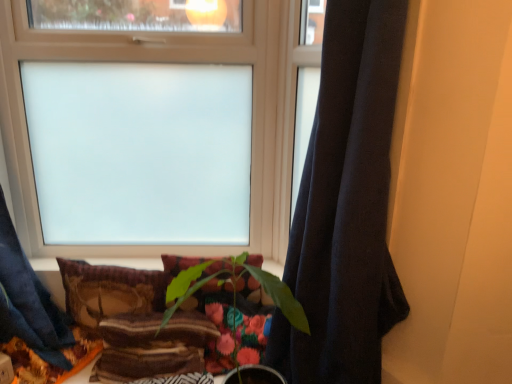
Question: Are green matte plant at center and velvet-like brown pillow at lower center, the 1th pillow viewed from the left, making contact?

Choices:
 (A) yes
 (B) no

Answer: (B)

Question: Is green matte plant at center positioned before velvet-like brown pillow at lower center, acting as the second pillow starting from the right?

Choices:
 (A) no
 (B) yes

Answer: (B)

Question: Does green matte plant at center have a larger size compared to velvet-like brown pillow at lower center, the 1th pillow viewed from the left?

Choices:
 (A) yes
 (B) no

Answer: (A)

Question: Does green matte plant at center have a lesser height compared to velvet-like brown pillow at lower center, the 1th pillow viewed from the left?

Choices:
 (A) no
 (B) yes

Answer: (A)

Question: From the image's perspective, is green matte plant at center located beneath velvet-like brown pillow at lower center, acting as the second pillow starting from the right?

Choices:
 (A) yes
 (B) no

Answer: (A)

Question: Would you say velvet-like brown pillow at lower center, the 1th pillow viewed from the left, is inside or outside green matte plant at center?

Choices:
 (A) inside
 (B) outside

Answer: (B)

Question: Is velvet-like brown pillow at lower center, the 1th pillow viewed from the left, wider or thinner than green matte plant at center?

Choices:
 (A) wide
 (B) thin

Answer: (B)

Question: Considering the relative positions of velvet-like brown pillow at lower center, the 1th pillow viewed from the left, and green matte plant at center in the image provided, is velvet-like brown pillow at lower center, the 1th pillow viewed from the left, to the left or to the right of green matte plant at center?

Choices:
 (A) right
 (B) left

Answer: (B)

Question: From a real-world perspective, is velvet-like brown pillow at lower center, acting as the second pillow starting from the right, positioned above or below green matte plant at center?

Choices:
 (A) above
 (B) below

Answer: (B)

Question: Is point (227, 51) closer or farther from the camera than point (219, 266)?

Choices:
 (A) closer
 (B) farther

Answer: (B)

Question: From a real-world perspective, is frosted glass window at upper center positioned above or below velvet textured pillow at center, which is the 2th pillow from left to right?

Choices:
 (A) below
 (B) above

Answer: (B)

Question: From their relative heights in the image, would you say frosted glass window at upper center is taller or shorter than velvet textured pillow at center, acting as the 1th pillow starting from the right?

Choices:
 (A) short
 (B) tall

Answer: (B)

Question: From the image's perspective, is frosted glass window at upper center above or below velvet textured pillow at center, which is the 2th pillow from left to right?

Choices:
 (A) below
 (B) above

Answer: (B)

Question: Looking at their shapes, would you say dark blue fabric curtain at right is wider or thinner than velvet-like brown pillow at lower center, the 1th pillow viewed from the left?

Choices:
 (A) thin
 (B) wide

Answer: (B)

Question: In the image, is dark blue fabric curtain at right positioned in front of or behind velvet-like brown pillow at lower center, the 1th pillow viewed from the left?

Choices:
 (A) behind
 (B) front

Answer: (B)